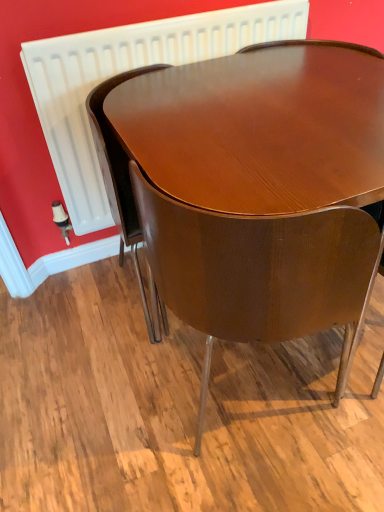
Question: Is white plastic radiator at upper center bigger than glossy wood chair at center, the first chair in the left-to-right sequence?

Choices:
 (A) no
 (B) yes

Answer: (A)

Question: Considering the relative sizes of white plastic radiator at upper center and glossy wood chair at center, the first chair in the left-to-right sequence, in the image provided, is white plastic radiator at upper center thinner than glossy wood chair at center, the first chair in the left-to-right sequence,?

Choices:
 (A) yes
 (B) no

Answer: (A)

Question: Is white plastic radiator at upper center not near glossy wood chair at center, the first chair in the left-to-right sequence?

Choices:
 (A) yes
 (B) no

Answer: (B)

Question: Is glossy wood chair at center, the first chair in the left-to-right sequence, at the back of white plastic radiator at upper center?

Choices:
 (A) no
 (B) yes

Answer: (B)

Question: Is white plastic radiator at upper center wider than glossy wood chair at center, the 2th chair viewed from the right?

Choices:
 (A) no
 (B) yes

Answer: (A)

Question: Is white plastic radiator at upper center in front of or behind glossy wood chair at center, which appears as the first chair when viewed from the right, in the image?

Choices:
 (A) behind
 (B) front

Answer: (A)

Question: Does point (198, 39) appear closer or farther from the camera than point (251, 340)?

Choices:
 (A) farther
 (B) closer

Answer: (A)

Question: From their relative heights in the image, would you say white plastic radiator at upper center is taller or shorter than glossy wood chair at center, which appears as the first chair when viewed from the right?

Choices:
 (A) tall
 (B) short

Answer: (B)

Question: From a real-world perspective, is white plastic radiator at upper center above or below glossy wood chair at center, which appears as the first chair when viewed from the right?

Choices:
 (A) below
 (B) above

Answer: (B)

Question: From a real-world perspective, is glossy wood chair at center, the 2th chair viewed from the right, positioned above or below white plastic radiator at upper center?

Choices:
 (A) below
 (B) above

Answer: (A)

Question: Is point (114, 185) positioned closer to the camera than point (89, 167)?

Choices:
 (A) farther
 (B) closer

Answer: (B)

Question: From the image's perspective, relative to white plastic radiator at upper center, is glossy wood chair at center, the 2th chair viewed from the right, above or below?

Choices:
 (A) below
 (B) above

Answer: (A)

Question: Based on their positions, is glossy wood chair at center, the first chair in the left-to-right sequence, located to the left or right of white plastic radiator at upper center?

Choices:
 (A) left
 (B) right

Answer: (A)

Question: Considering the positions of glossy wood chair at center, the first chair in the left-to-right sequence, and glossy wood chair at center, the second chair positioned from the left, in the image, is glossy wood chair at center, the first chair in the left-to-right sequence, taller or shorter than glossy wood chair at center, the second chair positioned from the left,?

Choices:
 (A) tall
 (B) short

Answer: (B)

Question: From the image's perspective, relative to glossy wood chair at center, the second chair positioned from the left, is glossy wood chair at center, the first chair in the left-to-right sequence, above or below?

Choices:
 (A) above
 (B) below

Answer: (A)